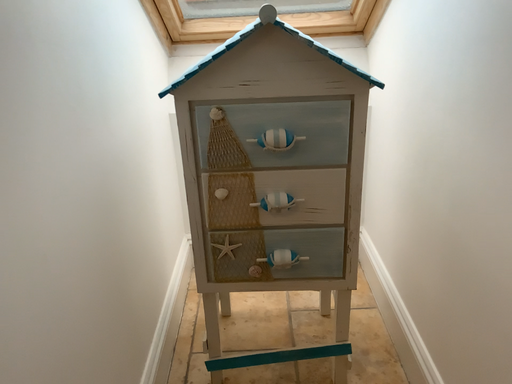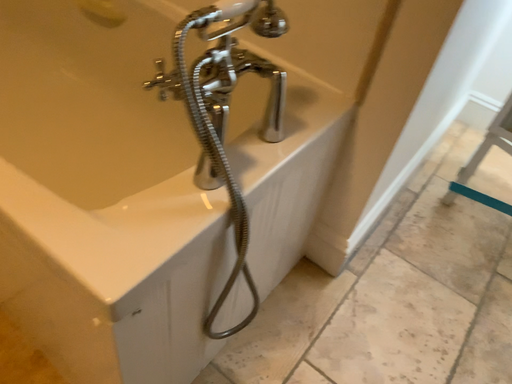
Question: Which way did the camera rotate in the video?

Choices:
 (A) rotated upward
 (B) rotated downward

Answer: (B)